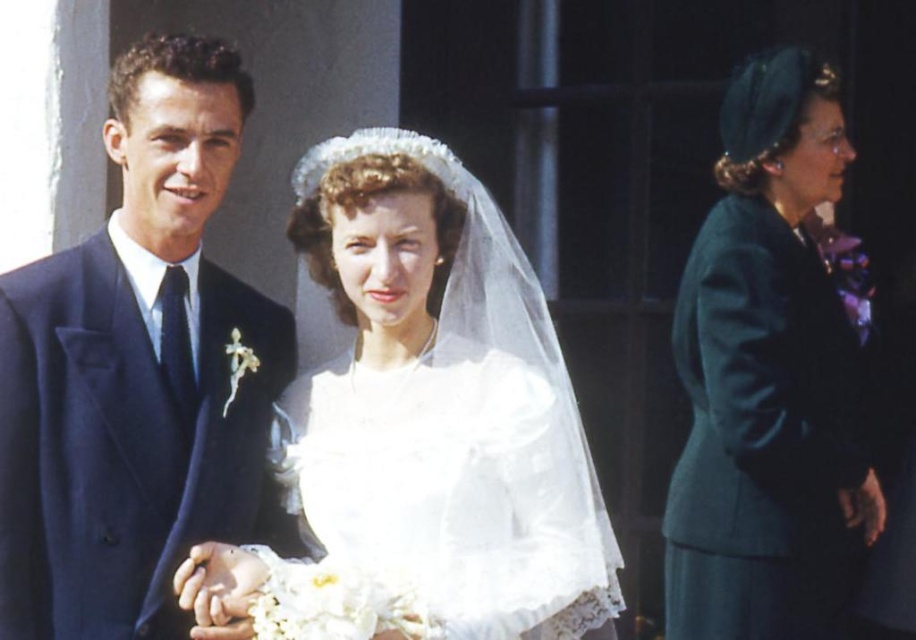
Question: Is white satin dress at center positioned at the back of pearl/textured tiara at center?

Choices:
 (A) no
 (B) yes

Answer: (A)

Question: Which object appears farthest from the camera in this image?

Choices:
 (A) teal woolen coat at right
 (B) white satin dress at center
 (C) pearl/textured tiara at center

Answer: (A)

Question: Which of the following is the farthest from the observer?

Choices:
 (A) (409, 156)
 (B) (786, 385)

Answer: (B)

Question: Can you confirm if white satin dress at center is smaller than pearl/textured tiara at center?

Choices:
 (A) yes
 (B) no

Answer: (B)

Question: Which object is closer to the camera taking this photo?

Choices:
 (A) pearl/textured tiara at center
 (B) teal woolen coat at right
 (C) navy blue suit at left
 (D) white satin dress at center

Answer: (D)

Question: From the image, what is the correct spatial relationship of navy blue suit at left in relation to pearl/textured tiara at center?

Choices:
 (A) right
 (B) left

Answer: (B)